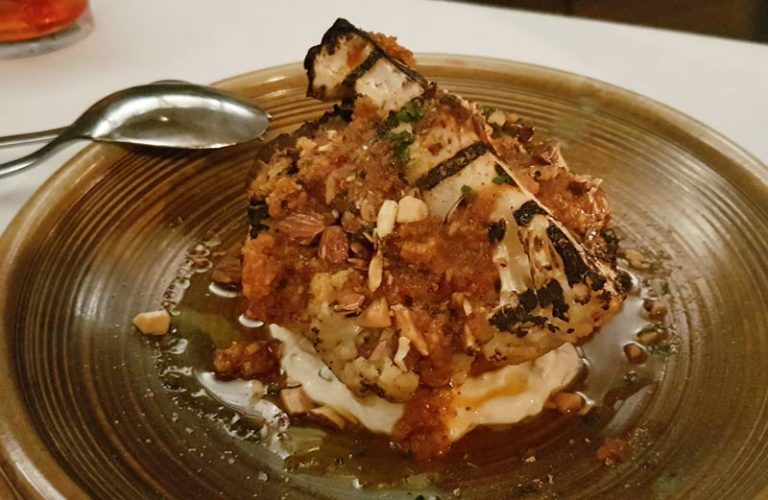
You are a GUI agent. You are given a task and a screenshot of the screen. Output one action in this format:
    pyautogui.click(x=<x>, y=<y>)
    Task: Click on the empty area on the back of the table top
    The image size is (768, 500).
    Given the screenshot: What is the action you would take?
    pyautogui.click(x=687, y=69)